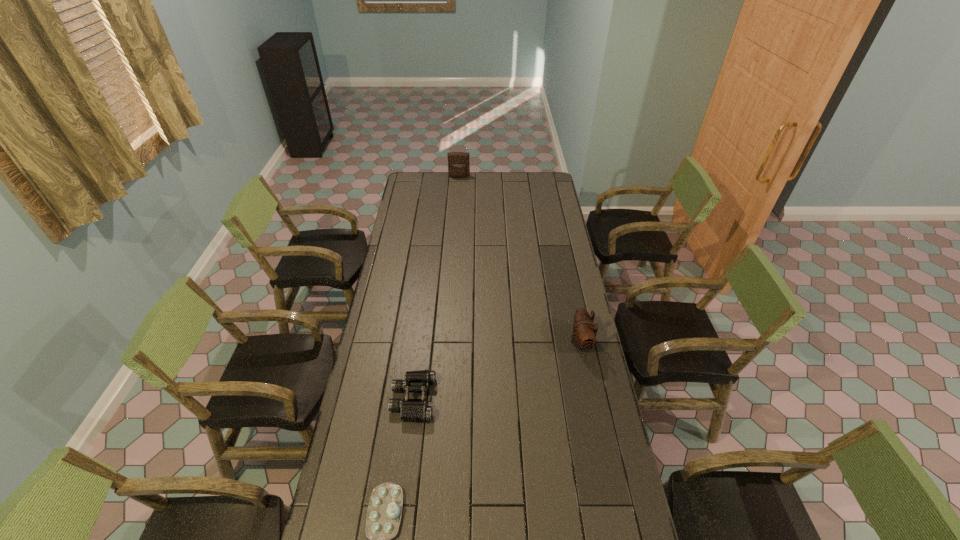
At what (x,y) coordinates should I click in order to perform the action: click on the farthest object. Please return your answer as a coordinate pair (x, y). This screenshot has width=960, height=540. Looking at the image, I should click on (x=458, y=162).

Where is `the left pouch`? This screenshot has width=960, height=540. the left pouch is located at coordinates (458, 162).

Find the location of `the rightmost object`. the rightmost object is located at coordinates (584, 332).

Locate an element on the screen. the right pouch is located at coordinates (584, 332).

The width and height of the screenshot is (960, 540). I want to click on the second shortest object, so click(x=418, y=410).

The image size is (960, 540). I want to click on binoculars, so click(418, 410).

This screenshot has height=540, width=960. I want to click on vacant region located 0.150m with an open flap on the left pouch, so point(458,192).

The height and width of the screenshot is (540, 960). Find the location of `free space located 0.150m with the flap open on the rightmost object`. free space located 0.150m with the flap open on the rightmost object is located at coordinates (534, 342).

This screenshot has height=540, width=960. I want to click on vacant region located with the flap open on the rightmost object, so click(x=532, y=342).

This screenshot has height=540, width=960. Identify the location of vacant point located with the flap open on the rightmost object. (505, 342).